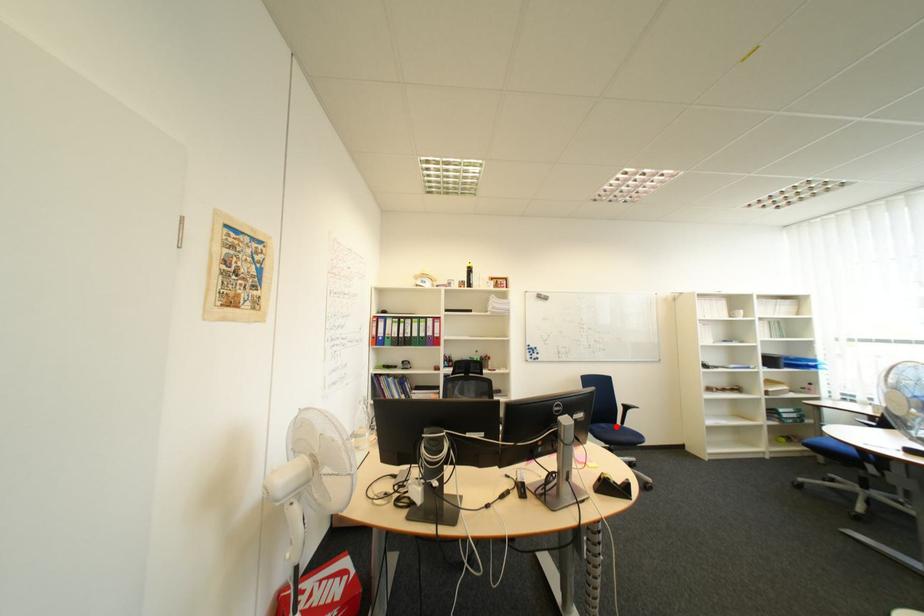
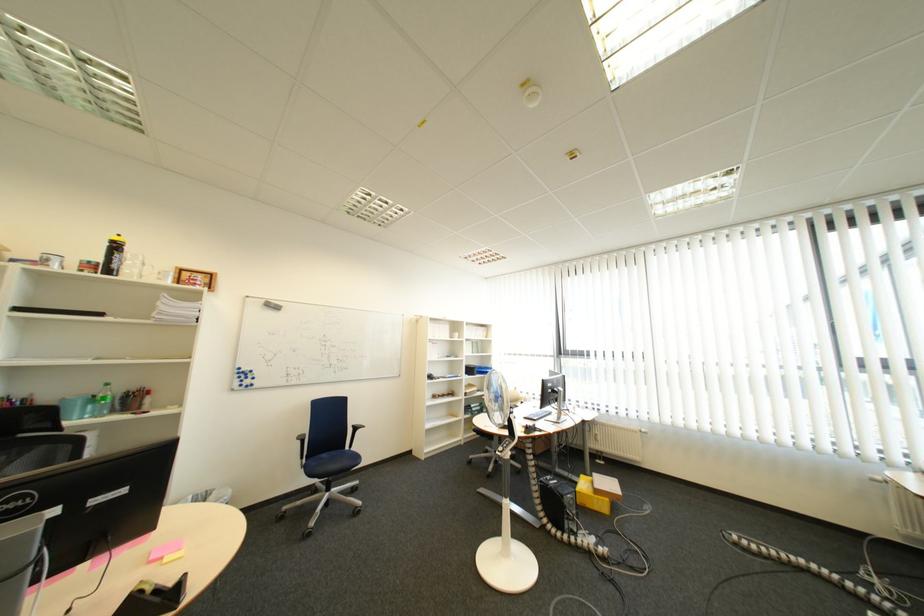
The point at the highlighted location is marked in the first image. Where is the corresponding point in the second image?

(337, 456)